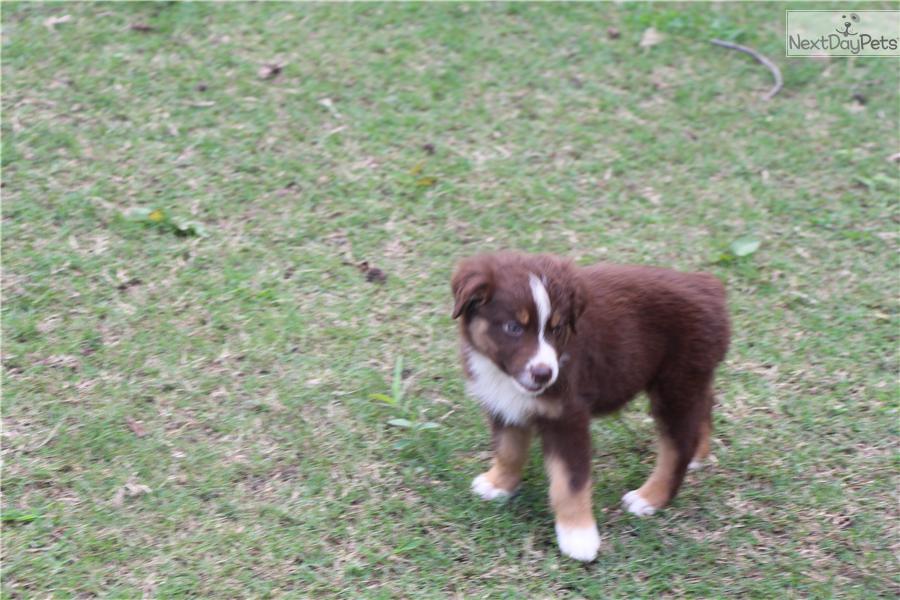
Image resolution: width=900 pixels, height=600 pixels. In order to click on white chest in this screenshot , I will do `click(500, 397)`.